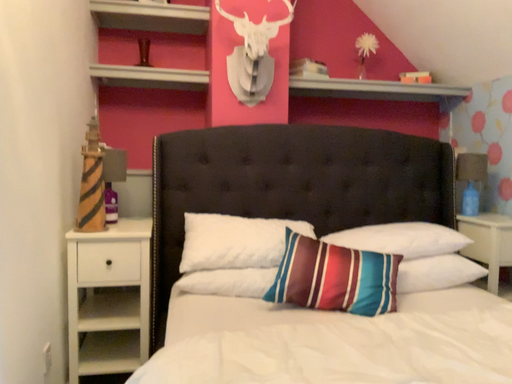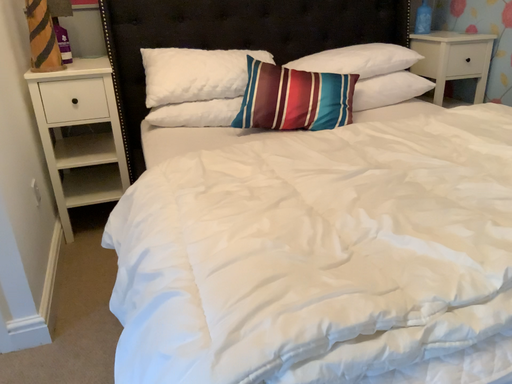
Question: How did the camera likely rotate when shooting the video?

Choices:
 (A) rotated right
 (B) rotated left

Answer: (A)